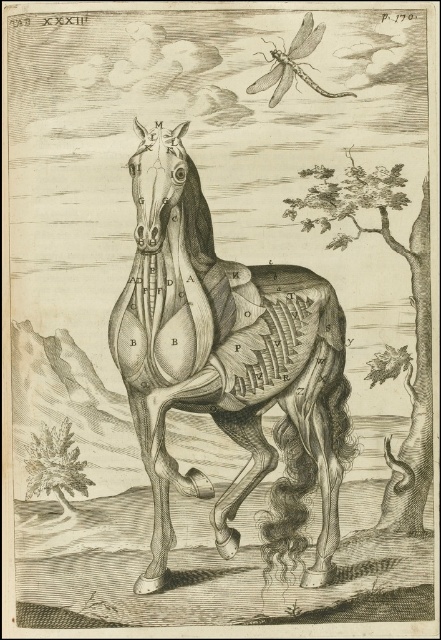
Based on the coordinates provided, which object in the image does the point at (223, 353) correspond to?

The point at (223, 353) corresponds to the gray textured horse at center.

You are an entomologist studying dragonflies and their habitats. You observe a gray textured horse at center and a translucent gray dragonfly at upper center in the image. Which object is taller?

The gray textured horse at center is much taller than the translucent gray dragonfly at upper center.